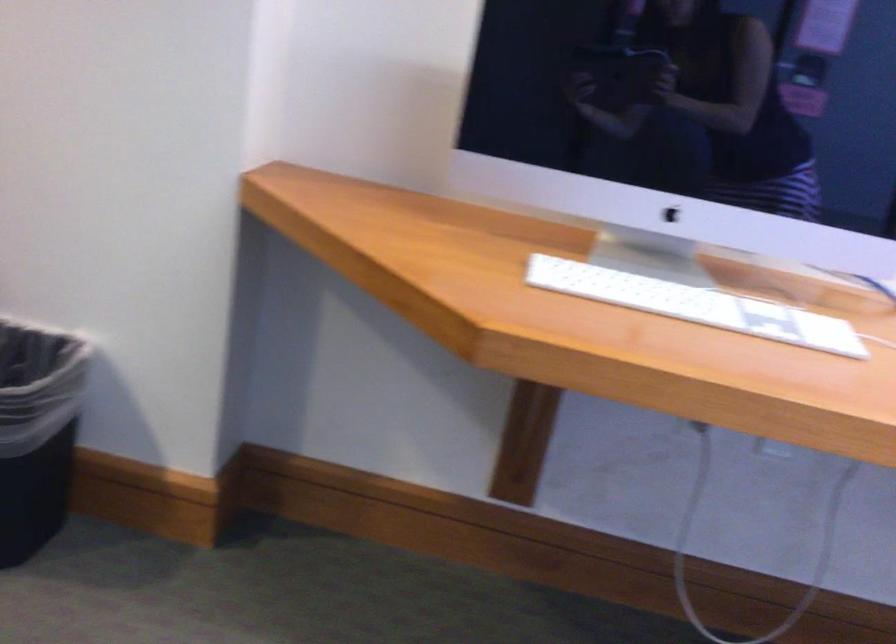
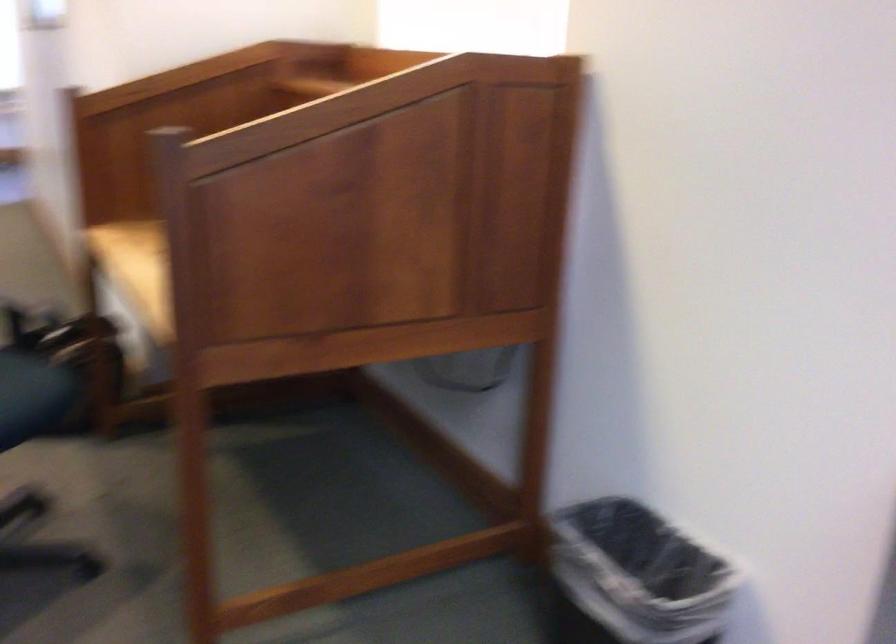
Question: The camera is either moving clockwise (left) or counter-clockwise (right) around the object. The first image is from the beginning of the video and the second image is from the end. Is the camera moving left or right when shooting the video?

Choices:
 (A) Left
 (B) Right

Answer: (B)